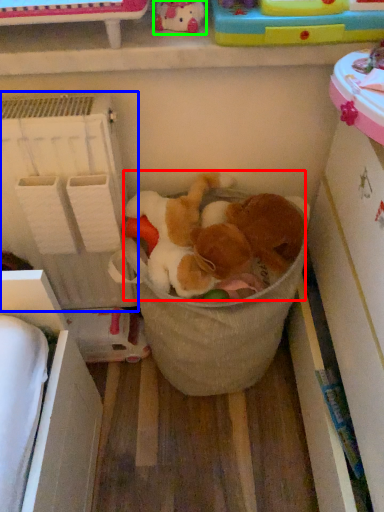
Question: Which object is the closest to the toy (highlighted by a red box)? Choose among these: shelf (highlighted by a blue box) or toy (highlighted by a green box).

Choices:
 (A) shelf
 (B) toy

Answer: (A)